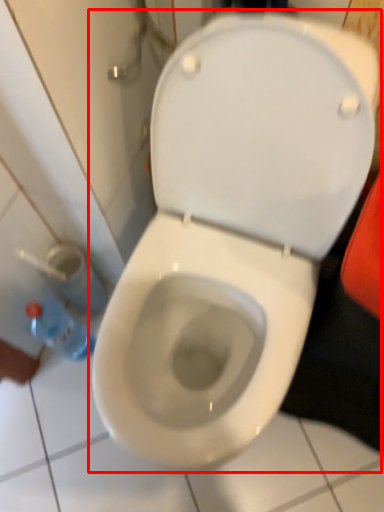
Question: From the image, what is the correct spatial relationship of toilet (annotated by the red box) in relation to bottle?

Choices:
 (A) left
 (B) right

Answer: (B)